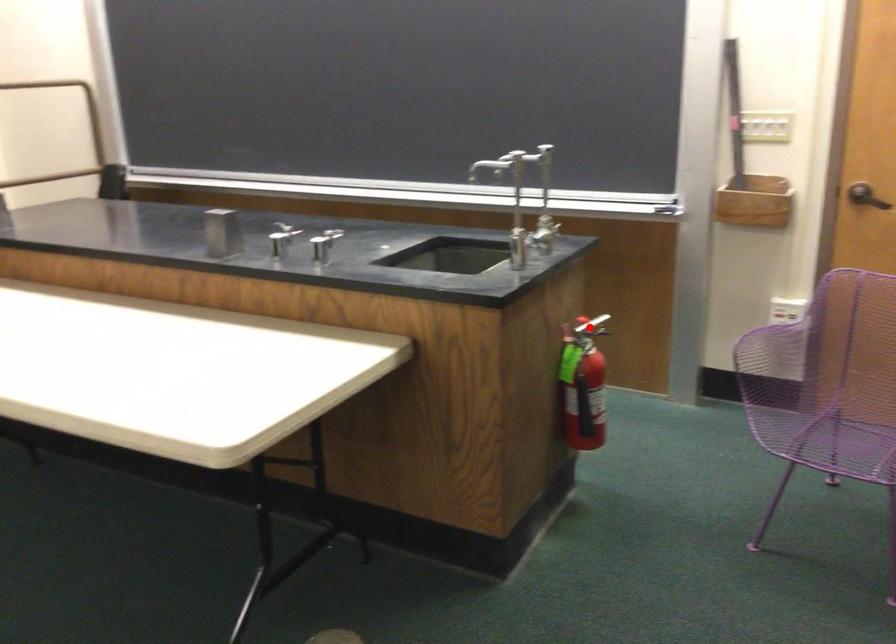
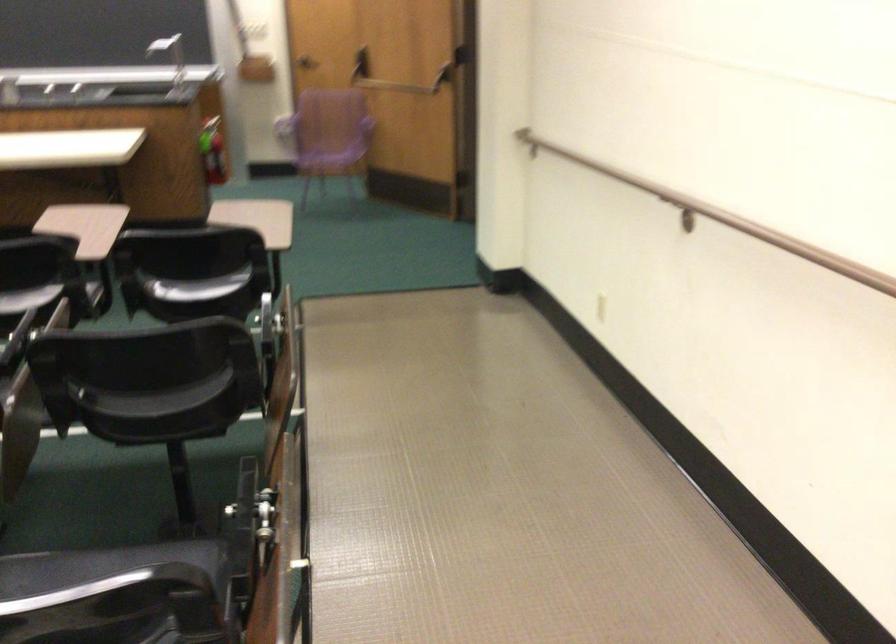
Find the pixel in the second image that matches the highlighted location in the first image.

(217, 124)